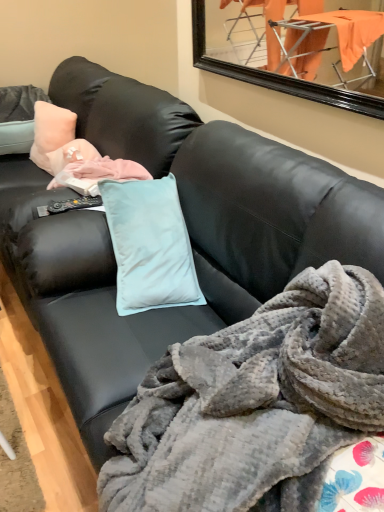
Question: Can you confirm if peach velvety pillow at upper left is positioned to the right of gray plush blanket at center?

Choices:
 (A) yes
 (B) no

Answer: (B)

Question: Can you confirm if peach velvety pillow at upper left is smaller than gray plush blanket at center?

Choices:
 (A) yes
 (B) no

Answer: (A)

Question: Can you confirm if peach velvety pillow at upper left is wider than gray plush blanket at center?

Choices:
 (A) no
 (B) yes

Answer: (A)

Question: Is peach velvety pillow at upper left closer to camera compared to gray plush blanket at center?

Choices:
 (A) no
 (B) yes

Answer: (A)

Question: Does peach velvety pillow at upper left have a lesser width compared to gray plush blanket at center?

Choices:
 (A) yes
 (B) no

Answer: (A)

Question: Can you confirm if peach velvety pillow at upper left is shorter than gray plush blanket at center?

Choices:
 (A) yes
 (B) no

Answer: (A)

Question: Does gray plush blanket at center have a greater width compared to peach velvety pillow at upper left?

Choices:
 (A) no
 (B) yes

Answer: (B)

Question: Can you confirm if gray plush blanket at center is shorter than peach velvety pillow at upper left?

Choices:
 (A) yes
 (B) no

Answer: (B)

Question: Considering the relative sizes of gray plush blanket at center and peach velvety pillow at upper left in the image provided, is gray plush blanket at center smaller than peach velvety pillow at upper left?

Choices:
 (A) yes
 (B) no

Answer: (B)

Question: Is gray plush blanket at center aimed at peach velvety pillow at upper left?

Choices:
 (A) no
 (B) yes

Answer: (A)

Question: Is gray plush blanket at center not within peach velvety pillow at upper left?

Choices:
 (A) no
 (B) yes

Answer: (B)

Question: From the image's perspective, is gray plush blanket at center located above peach velvety pillow at upper left?

Choices:
 (A) yes
 (B) no

Answer: (B)

Question: In the image, is gray plush blanket at center on the left side or the right side of peach velvety pillow at upper left?

Choices:
 (A) right
 (B) left

Answer: (A)